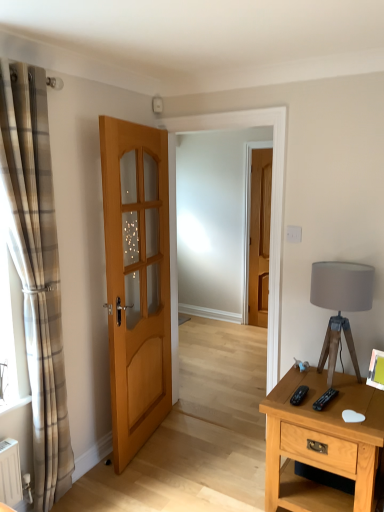
Question: Is light brown wooden door at center, the first door viewed from the left, further to camera compared to matte wooden door at center, which is the first door from right to left?

Choices:
 (A) yes
 (B) no

Answer: (B)

Question: Is light brown wooden door at center, the first door viewed from the left, next to matte wooden door at center, which is the first door from right to left?

Choices:
 (A) yes
 (B) no

Answer: (B)

Question: Is light brown wooden door at center, acting as the second door starting from the back, not inside matte wooden door at center, the 2th door viewed from the left?

Choices:
 (A) no
 (B) yes

Answer: (B)

Question: From the image's perspective, is light brown wooden door at center, the 1th door viewed from the front, above matte wooden door at center, the 2th door viewed from the left?

Choices:
 (A) yes
 (B) no

Answer: (B)

Question: Does light brown wooden door at center, acting as the second door starting from the back, have a smaller size compared to matte wooden door at center, which ranks as the 2th door in front-to-back order?

Choices:
 (A) yes
 (B) no

Answer: (B)

Question: From their relative heights in the image, would you say plaid fabric curtain at left is taller or shorter than light brown wooden nightstand at right?

Choices:
 (A) short
 (B) tall

Answer: (B)

Question: In the image, is plaid fabric curtain at left positioned in front of or behind light brown wooden nightstand at right?

Choices:
 (A) front
 (B) behind

Answer: (A)

Question: From the image's perspective, relative to light brown wooden nightstand at right, is plaid fabric curtain at left above or below?

Choices:
 (A) above
 (B) below

Answer: (A)

Question: Considering the positions of plaid fabric curtain at left and light brown wooden nightstand at right in the image, is plaid fabric curtain at left bigger or smaller than light brown wooden nightstand at right?

Choices:
 (A) small
 (B) big

Answer: (A)

Question: In terms of width, does matte gray fabric lampshade at right look wider or thinner when compared to plaid fabric curtain at left?

Choices:
 (A) thin
 (B) wide

Answer: (B)

Question: From a real-world perspective, is matte gray fabric lampshade at right above or below plaid fabric curtain at left?

Choices:
 (A) above
 (B) below

Answer: (B)

Question: Is point (350, 339) positioned closer to the camera than point (39, 234)?

Choices:
 (A) closer
 (B) farther

Answer: (B)

Question: Would you say matte gray fabric lampshade at right is to the left or to the right of plaid fabric curtain at left in the picture?

Choices:
 (A) right
 (B) left

Answer: (A)

Question: Considering the positions of point (324, 285) and point (158, 159), is point (324, 285) closer or farther from the camera than point (158, 159)?

Choices:
 (A) closer
 (B) farther

Answer: (A)

Question: From the image's perspective, is matte gray fabric lampshade at right located above or below light brown wooden door at center, the first door viewed from the left?

Choices:
 (A) above
 (B) below

Answer: (B)